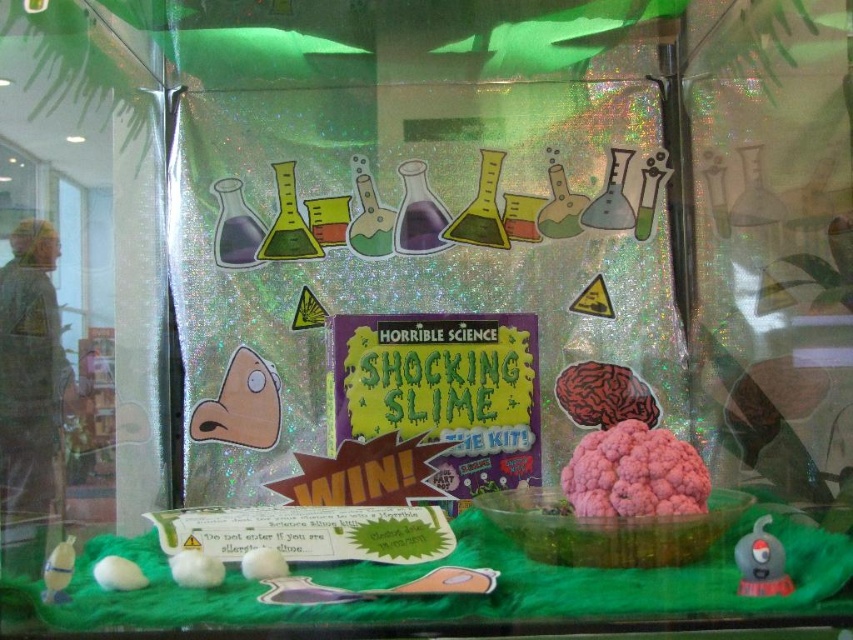
From the picture: You are organizing a science fair booth and need to place a small prize inside the display. The prize must fit within the space available. Which object, the holographic plastic box at center or the green matte poster at center, can accommodate the prize?

Answer: The holographic plastic box at center is larger in size than the green matte poster at center, so the prize can fit inside the holographic plastic box at center.

You are setting up a display for a science fair and need to place a holographic plastic box at center and a green matte poster at center. According to the image, which object is positioned to the left of the other?

The holographic plastic box at center is to the left of the green matte poster at center.

You are setting up a science fair booth and need to place a holographic plastic box at center and a green matte poster at center. The display area has a rule that items must be at least 5 inches apart. Based on the image, will these two items meet the requirement?

The distance between the holographic plastic box at center and the green matte poster at center is 4.91 inches, which is less than the required 5 inches. Therefore, they do not meet the requirement.